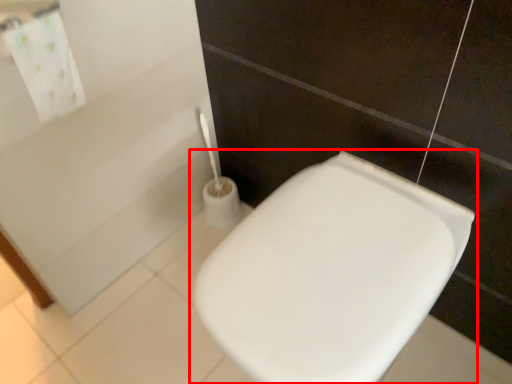
Question: From the image's perspective, where is toilet (annotated by the red box) located relative to bath towel?

Choices:
 (A) below
 (B) above

Answer: (A)